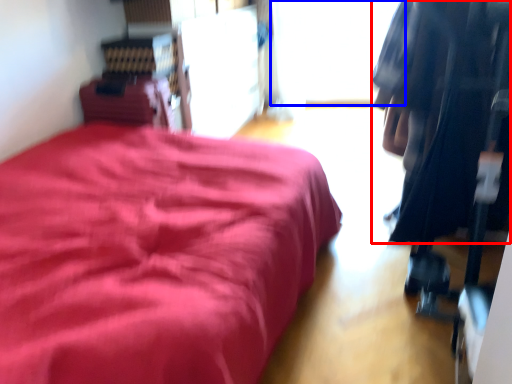
Question: Which object appears closest to the camera in this image, clothing (highlighted by a red box) or window (highlighted by a blue box)?

Choices:
 (A) clothing
 (B) window

Answer: (A)